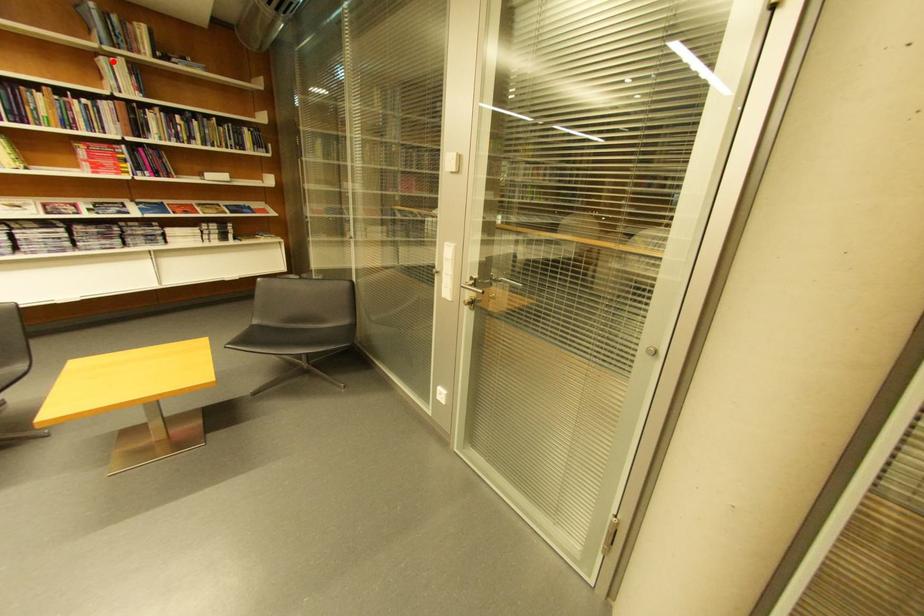
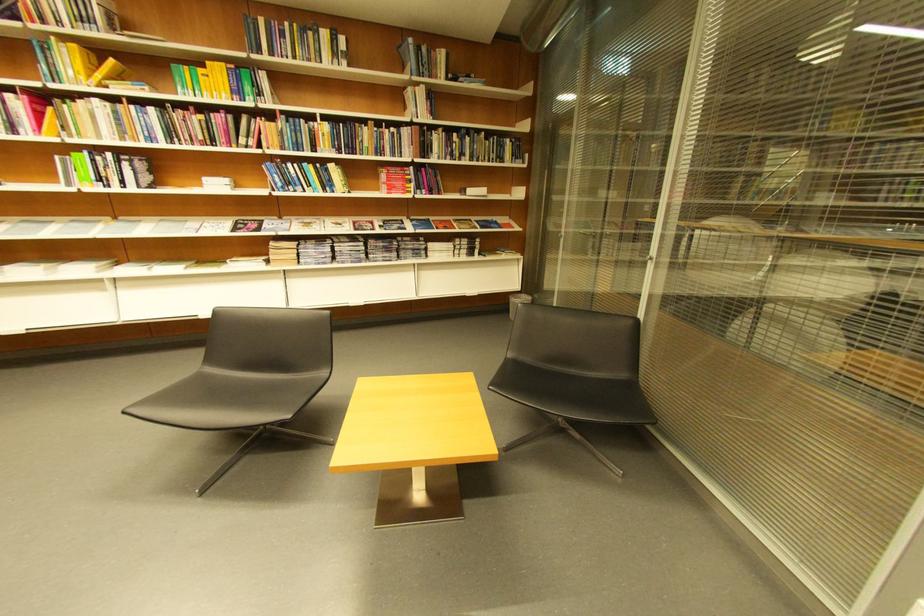
Locate, in the second image, the point that corresponds to the highlighted location in the first image.

(419, 91)